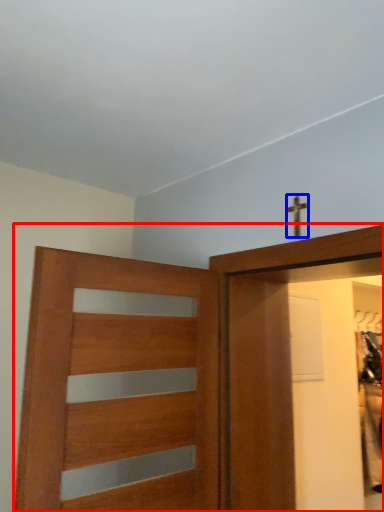
Question: Which object appears farthest to the camera in this image, door (highlighted by a red box) or crucifix (highlighted by a blue box)?

Choices:
 (A) door
 (B) crucifix

Answer: (B)